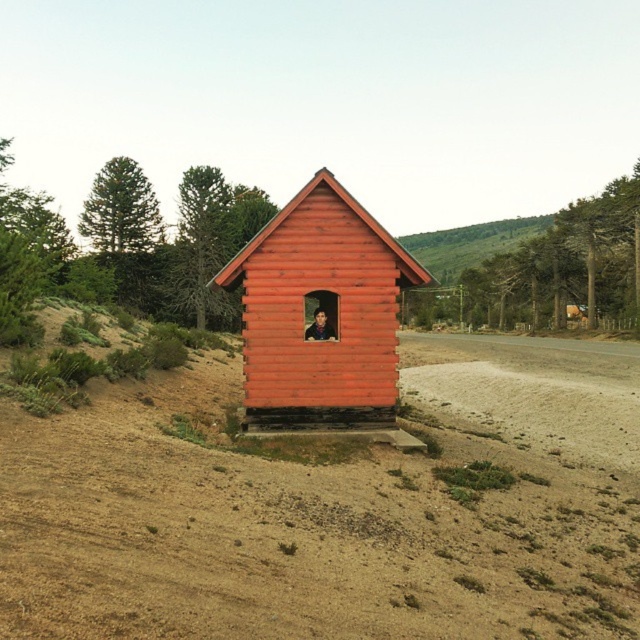
You are standing in front of the smooth wooden cabin at center and want to walk to the dull brown dirt at center. Which direction should you move relative to the cabin?

You should move to the right of the smooth wooden cabin at center to reach the dull brown dirt at center, as the dull brown dirt at center is located to the right of the cabin.

You are standing in front of the smooth wooden cabin at center and want to walk towards the dull brown dirt at center. Is the path clear of any obstacles between them?

The dull brown dirt at center is in front of the smooth wooden cabin at center, so there are no obstacles between them. You can walk directly towards the dull brown dirt at center.

You are standing in front of the rustic red wooden cabin and notice two points marked on the ground. The first point is at coordinates point (513, 348) and the second point is at point (346, 260). Which point is closer to you?

Point (513, 348) is further to the viewer than point (346, 260), so the point closer to you is point (346, 260).